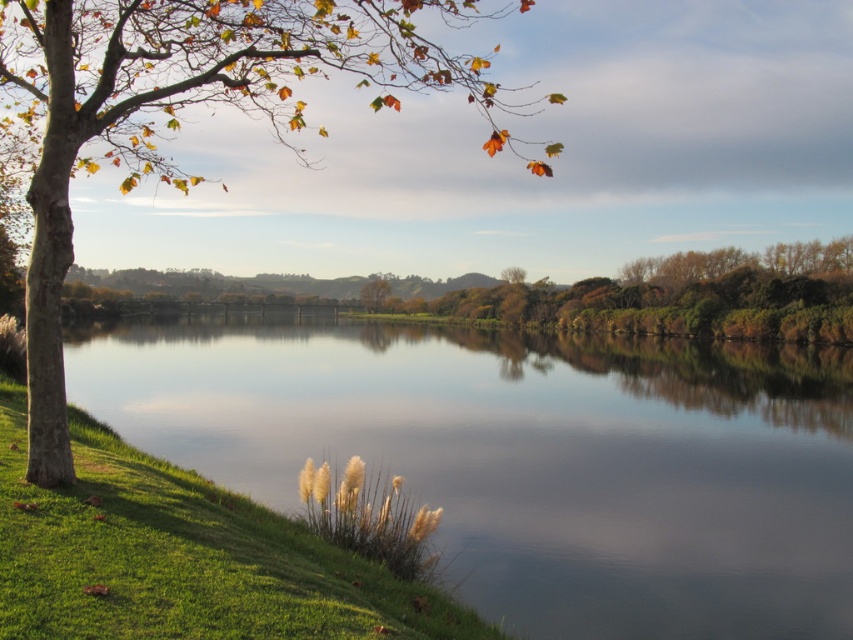
Based on the provided scene description, where is the green leafy trees at center located in terms of 2D coordinates?

The green leafy trees at center are located at the 2D coordinates of point (682, 296).

You are standing at the riverside and want to reach a specific point marked as point (706, 625). Given that your maximum walking distance is 30 feet, can you reach that point without exceeding your limit?

The point (706, 625) is 34.76 feet away from you, which exceeds your maximum walking distance of 30 feet. Therefore, you cannot reach that point without exceeding your limit.

You are standing at the riverside and want to walk from the green grassy bank at lower left to the green leafy trees at center. Which direction should you head to reach the trees?

You should head to the right to reach the green leafy trees at center because the green grassy bank at lower left is located to the left of them.